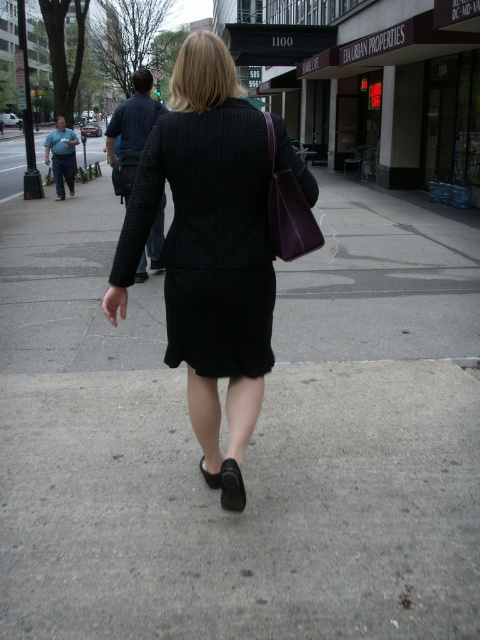
Question: Does matte black skirt at center appear over black textured blazer at upper center?

Choices:
 (A) no
 (B) yes

Answer: (A)

Question: From the image, what is the correct spatial relationship of matte black skirt at center in relation to black textured blazer at upper center?

Choices:
 (A) above
 (B) below

Answer: (B)

Question: Which point is farther to the camera?

Choices:
 (A) (204, 403)
 (B) (151, 260)

Answer: (B)

Question: Considering the relative positions of matte black skirt at center and black textured blazer at upper center in the image provided, where is matte black skirt at center located with respect to black textured blazer at upper center?

Choices:
 (A) below
 (B) above

Answer: (A)